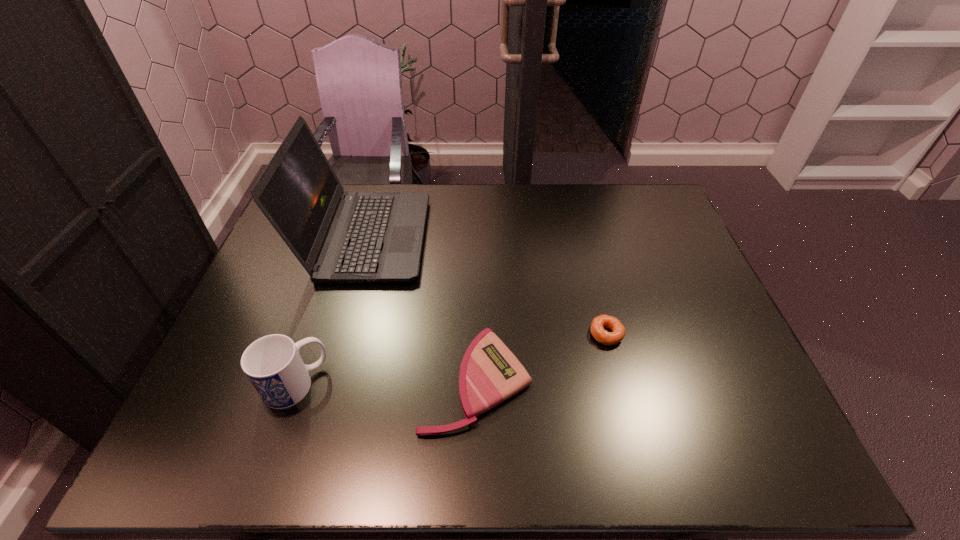
Identify the location of object situated at the near edge. (490, 373).

This screenshot has height=540, width=960. I want to click on laptop_computer located at the left edge, so click(338, 237).

At what (x,y) coordinates should I click in order to perform the action: click on mug that is at the left edge. Please return your answer as a coordinate pair (x, y). Looking at the image, I should click on (272, 363).

Locate an element on the screen. This screenshot has width=960, height=540. object that is at the far left corner is located at coordinates (338, 237).

This screenshot has height=540, width=960. In order to click on free location at the far edge in this screenshot , I will do click(581, 217).

Image resolution: width=960 pixels, height=540 pixels. Identify the location of vacant space at the near edge. (324, 462).

The height and width of the screenshot is (540, 960). In order to click on vacant space at the left edge of the desktop in this screenshot , I will do `click(281, 253)`.

Where is `vacant region at the right edge`? vacant region at the right edge is located at coordinates (636, 245).

At what (x,y) coordinates should I click in order to perform the action: click on vacant space at the far left corner of the desktop. Please return your answer as a coordinate pair (x, y). Image resolution: width=960 pixels, height=540 pixels. Looking at the image, I should click on 342,186.

Where is `free location at the near right corner`? This screenshot has height=540, width=960. free location at the near right corner is located at coordinates (710, 447).